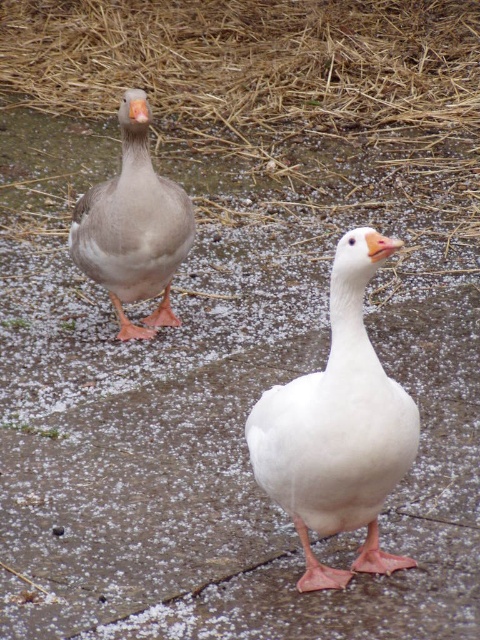
You are standing at the origin point in the image and want to reach the point labeled point (373, 252). Which direction should you move relative to point (147, 108)?

To reach point (373, 252), you should move towards the direction away from point (147, 108) since point (373, 252) is in front of point (147, 108).

You are a birdwatcher observing the geese in the image. You notice the orange matte beak at center and the matte gray beak at upper left. Which beak is located lower in the image?

The orange matte beak at center is positioned under the matte gray beak at upper left, so it is lower in the image.